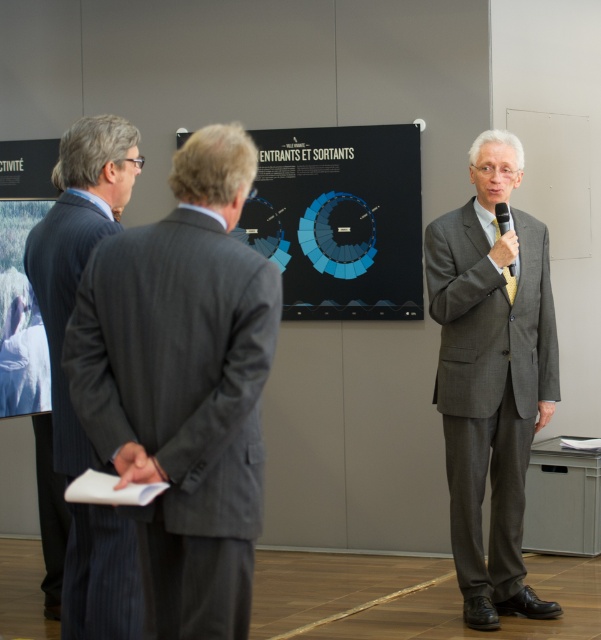
You are an attendee at a conference and need to locate the presenter who is standing near the black matte projection screen at center. Which direction should you move from the gray pinstripe suit at left to find them?

The presenter is to the right of the gray pinstripe suit at left since the gray pinstripe suit at left is positioned on the left side of the black matte projection screen at center.

You are organizing a photo shoot and need to arrange the gray pinstripe suit at left and the gray suit at center based on their sizes. Which one should you place first if you want to follow the order from smallest to largest?

The gray pinstripe suit at left should be placed first since it is smaller than the gray suit at center.